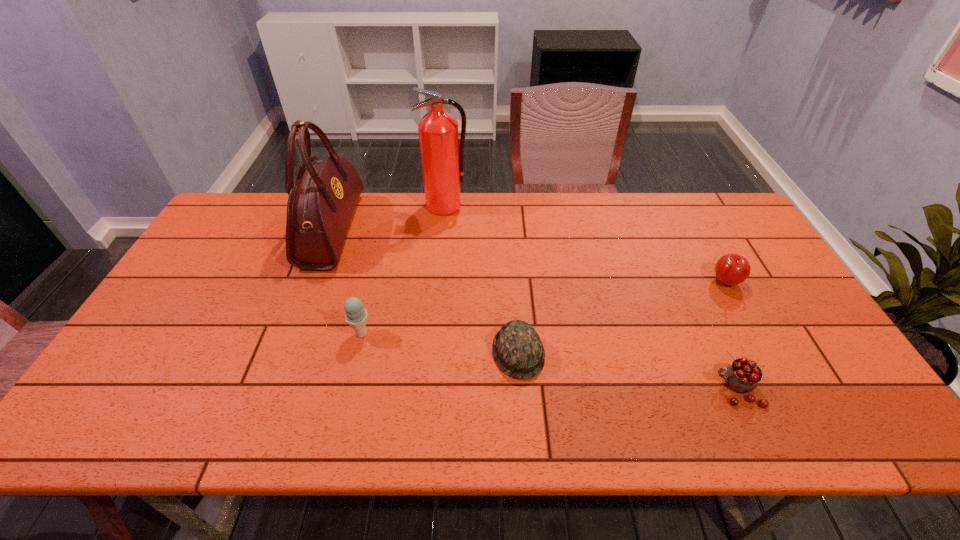
The height and width of the screenshot is (540, 960). I want to click on free space between the nearer cherry and the headwear, so click(628, 371).

At what (x,y) coordinates should I click in order to perform the action: click on empty space between the rightmost object and the second object from right to left. Please return your answer as a coordinate pair (x, y). The width and height of the screenshot is (960, 540). Looking at the image, I should click on (732, 336).

Identify the location of free area in between the farther cherry and the ice cream. Image resolution: width=960 pixels, height=540 pixels. (544, 308).

I want to click on vacant space that's between the second object from right to left and the leftmost object, so click(535, 309).

Where is `free space between the shortest object and the fourth object from right to left`? free space between the shortest object and the fourth object from right to left is located at coordinates (482, 279).

This screenshot has width=960, height=540. Identify the location of blank region between the fourth object from right to left and the right cherry. (586, 244).

Image resolution: width=960 pixels, height=540 pixels. In order to click on free space between the shortest object and the handbag in this screenshot , I will do `click(425, 292)`.

Image resolution: width=960 pixels, height=540 pixels. Find the location of `object that ranks as the fourth closest to the fire extinguisher`. object that ranks as the fourth closest to the fire extinguisher is located at coordinates (731, 269).

Find the location of a particular element. object that stands as the second closest to the right cherry is located at coordinates (517, 348).

Where is `vacant area that satisfies the following two spatial constraints: 1. at the nozzle of the third object from left to right; 2. on the front-facing side of the handbag`? Image resolution: width=960 pixels, height=540 pixels. vacant area that satisfies the following two spatial constraints: 1. at the nozzle of the third object from left to right; 2. on the front-facing side of the handbag is located at coordinates (443, 230).